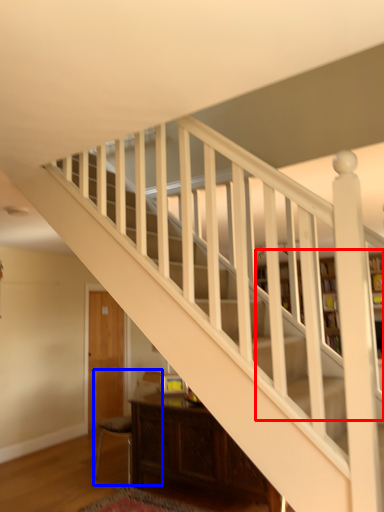
Question: Which object is closer to the camera taking this photo, bookcase (highlighted by a red box) or armchair (highlighted by a blue box)?

Choices:
 (A) bookcase
 (B) armchair

Answer: (B)